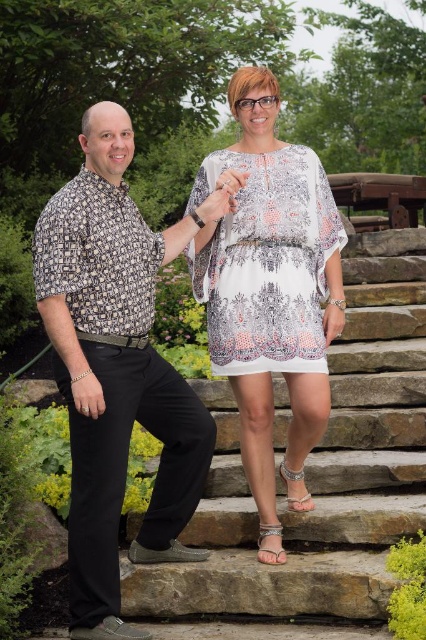
You are a photographer trying to capture the perfect shot of the scene. You need to position your camera so that the white sheer dress at center is centered in the frame. Based on the coordinates provided, where should you aim your camera?

The white sheer dress at center is located at coordinates point [270,280], so you should aim your camera at that point to center it in the frame.

You are a photographer setting up a photo shoot for a clothing brand. You have two outfits to feature in the image provided. The first is the printed cotton shirt at left, and the second is the white printed fabric dress at center. The brand wants to highlight the slimming effect of the outfits. Based on the scene description, which outfit would you recommend for a model aiming to appear slimmer?

The printed cotton shirt at left is thinner than the white printed fabric dress at center, so the printed cotton shirt at left would be better for creating a slimmer appearance.